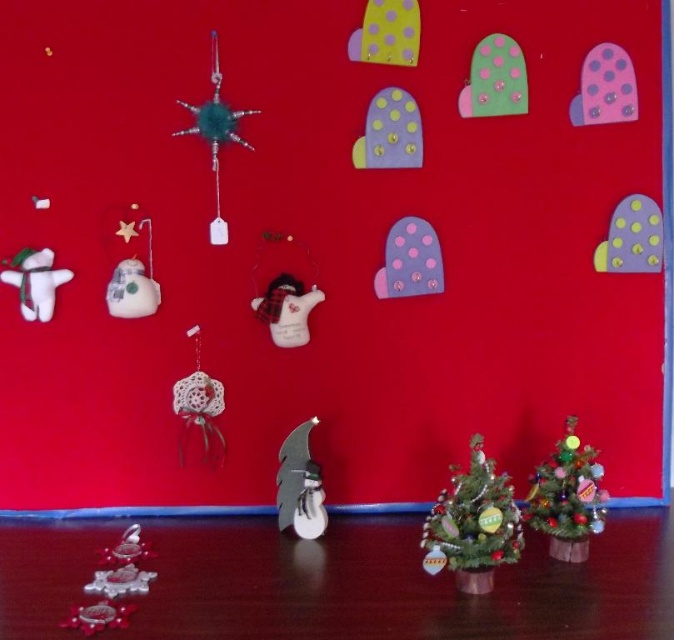
Question: Which point is farther from the camera taking this photo?

Choices:
 (A) (406, 49)
 (B) (220, 81)

Answer: (A)

Question: In this image, where is shiny green christmas tree at lower right located relative to purple felt mittens at upper center?

Choices:
 (A) right
 (B) left

Answer: (A)

Question: Does shiny green christmas tree at lower center appear on the right side of shiny green christmas tree at lower right?

Choices:
 (A) yes
 (B) no

Answer: (B)

Question: Can you confirm if purple felt mitten at upper right is thinner than white lace ornament at center-left?

Choices:
 (A) yes
 (B) no

Answer: (B)

Question: Among these points, which one is farthest from the camera?

Choices:
 (A) (408, 124)
 (B) (175, 388)

Answer: (B)

Question: Which of these objects is positioned farthest from the purple felt mitten at upper right?

Choices:
 (A) pink felt mittens at upper right
 (B) purple felt mitten at upper center
 (C) wooden snowman at center
 (D) shiny green christmas tree at lower right

Answer: (C)